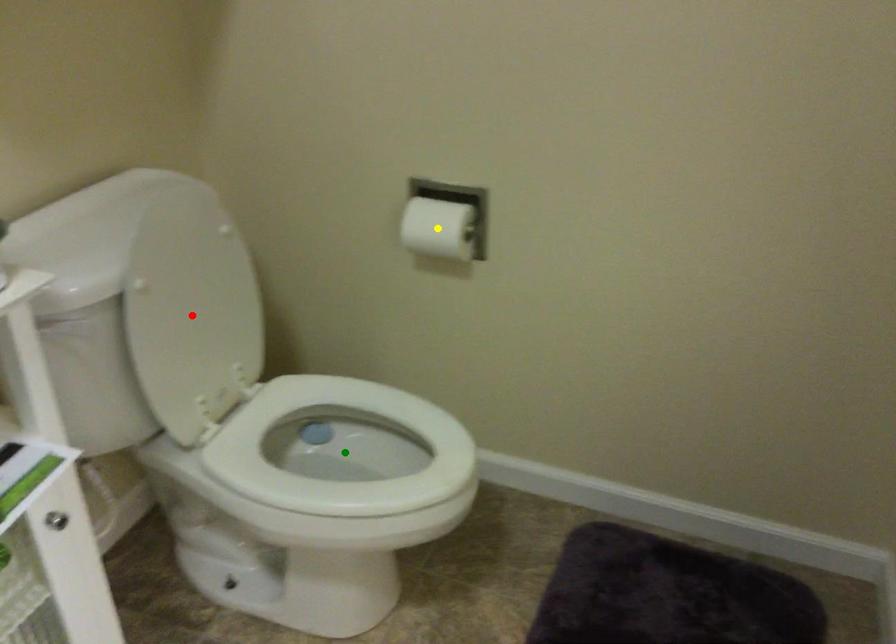
Order these from nearest to farthest:
green point | red point | yellow point

red point → green point → yellow point